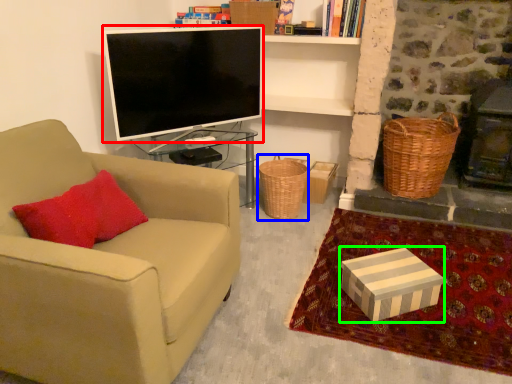
Question: Considering the real-world distances, which object is farthest from television (highlighted by a red box)? basket (highlighted by a blue box) or box (highlighted by a green box)?

Choices:
 (A) basket
 (B) box

Answer: (B)